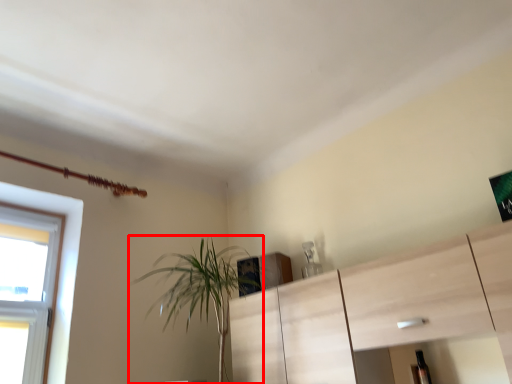
Question: From the image's perspective, considering the relative positions of houseplant (annotated by the red box) and bottle in the image provided, where is houseplant (annotated by the red box) located with respect to the staircase?

Choices:
 (A) below
 (B) above

Answer: (B)